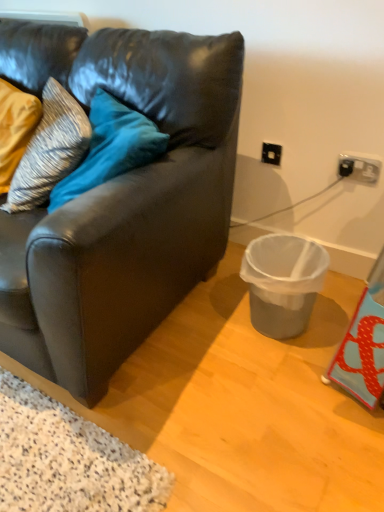
Question: Is matte black couch at center to the left or to the right of black plastic power outlet at upper right in the image?

Choices:
 (A) left
 (B) right

Answer: (A)

Question: Does point (140, 170) appear closer or farther from the camera than point (375, 181)?

Choices:
 (A) closer
 (B) farther

Answer: (A)

Question: Which is nearer to the black plastic power outlet at upper right?

Choices:
 (A) striped fabric pillow at left
 (B) matte black couch at center
 (C) black plastic electric outlet at upper right
 (D) gray plastic trash can at lower right

Answer: (C)

Question: Which object is positioned closest to the striped fabric pillow at left?

Choices:
 (A) gray plastic trash can at lower right
 (B) matte black couch at center
 (C) black plastic power outlet at upper right
 (D) black plastic electric outlet at upper right

Answer: (B)